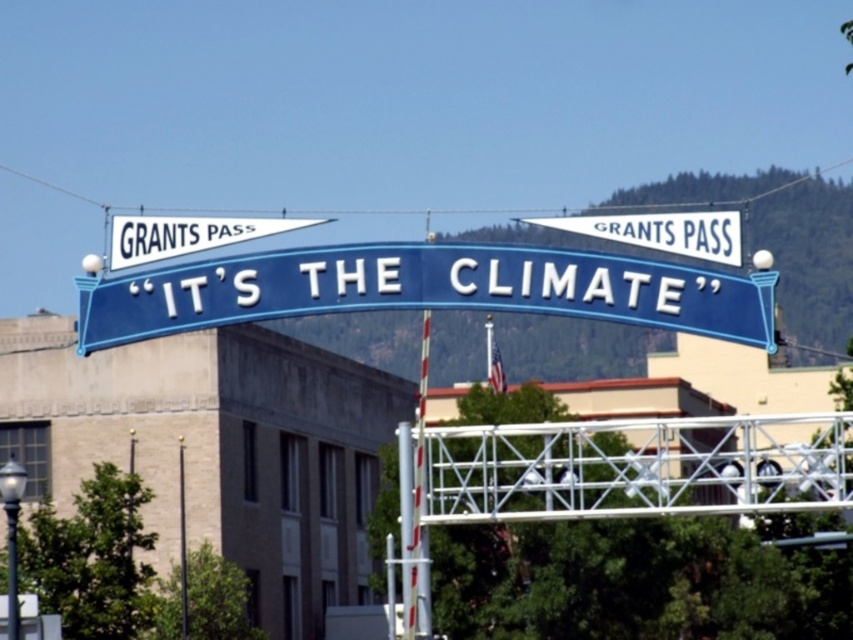
Question: Which of the following is the farthest from the observer?

Choices:
 (A) (610, 216)
 (B) (184, 529)
 (C) (125, 259)
 (D) (428, 596)

Answer: (B)

Question: Does blue metallic sign at center have a lesser width compared to white fabric pennant at upper center?

Choices:
 (A) no
 (B) yes

Answer: (A)

Question: Which point appears closest to the camera in this image?

Choices:
 (A) (178, 477)
 (B) (646, 243)

Answer: (B)

Question: Is blue metallic sign at center positioned before metallic silver pole at center?

Choices:
 (A) yes
 (B) no

Answer: (B)

Question: Which of the following is the farthest from the observer?

Choices:
 (A) (184, 579)
 (B) (703, 259)
 (C) (427, 227)

Answer: (C)

Question: Is metallic silver pole at center above smooth metal pole at center?

Choices:
 (A) no
 (B) yes

Answer: (B)